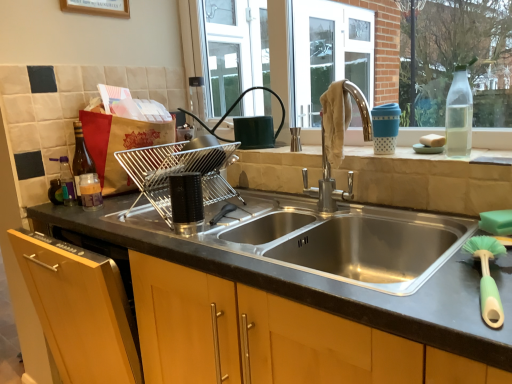
Identify the location of vacant space in front of translucent plastic bottle at left, the second bottle positioned from the front. The image size is (512, 384). (93, 220).